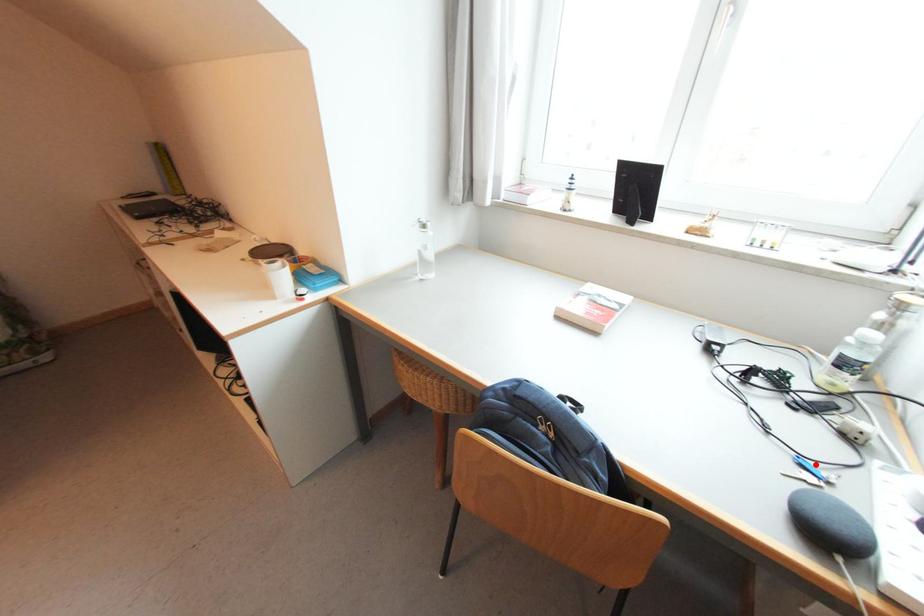
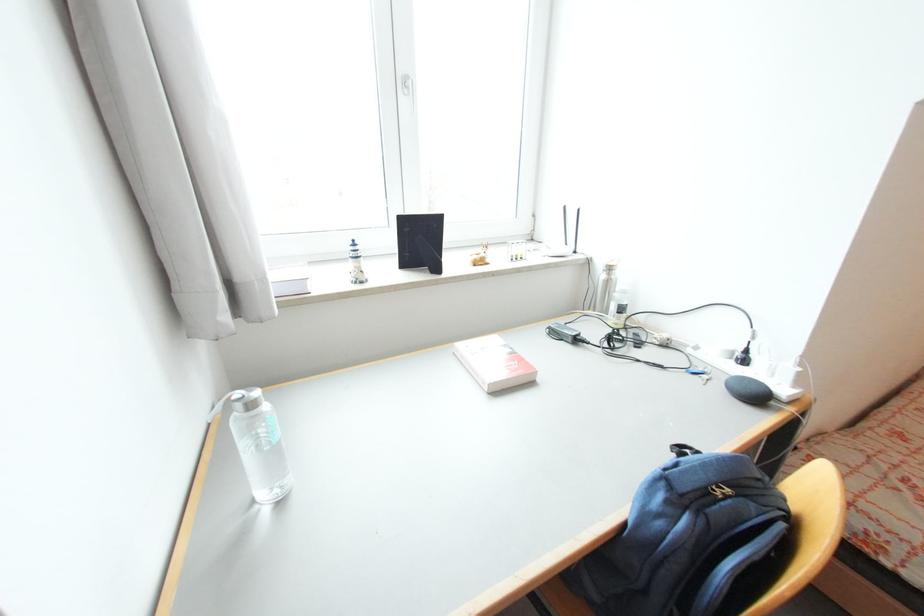
Where in the second image is the point corresponding to the highlighted location from the first image?

(697, 370)